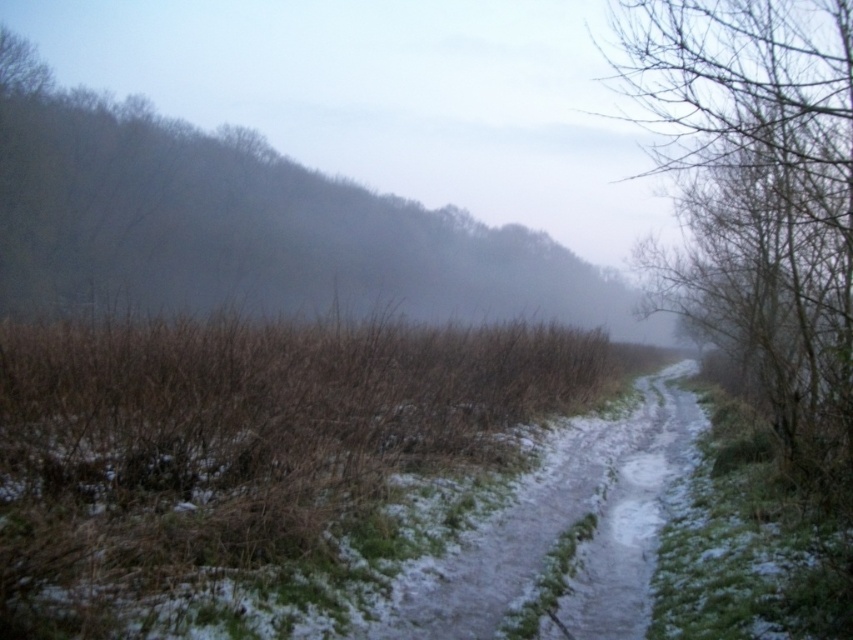
Is point (753, 381) more distant than point (595, 556)?

That is True.

Does point (827, 355) lie in front of point (440, 632)?

No, it is not.

Identify the location of bare branches at right. (761, 200).